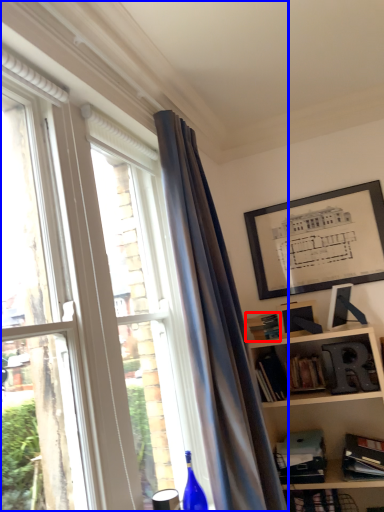
Question: Which of the following is the closest to the observer, paperback book (highlighted by a red box) or window (highlighted by a blue box)?

Choices:
 (A) paperback book
 (B) window

Answer: (B)